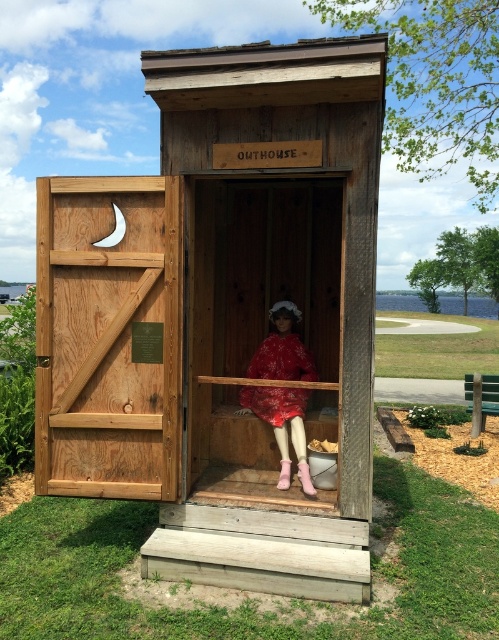
You are a visitor at this outdoor location and want to take a photo of the wooden outhouse at center and the red velvet dress at center. Since you want both subjects to be in focus, you need to know which one is closer to you. Can you determine which object is nearer based on their sizes?

The wooden outhouse at center is much taller than the red velvet dress at center, so the wooden outhouse at center is closer to you because larger objects in the scene are typically nearer to the viewer.